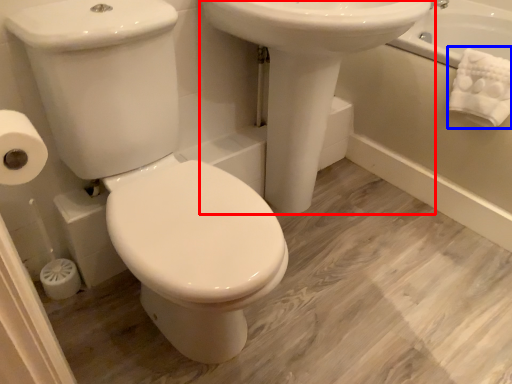
Question: Among these objects, which one is nearest to the camera, sink (highlighted by a red box) or bath towel (highlighted by a blue box)?

Choices:
 (A) sink
 (B) bath towel

Answer: (A)